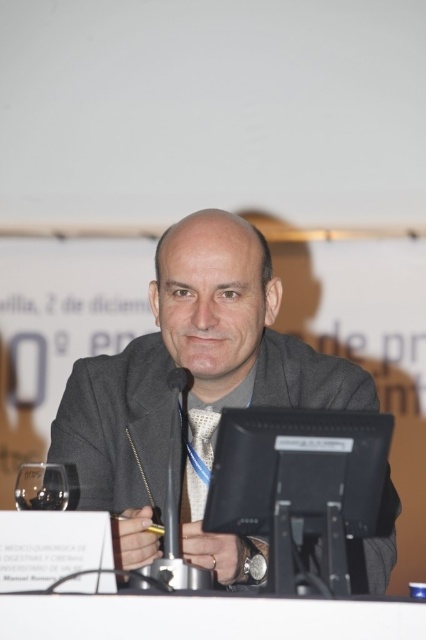
Who is positioned more to the right, gray woolen suit at center or black plastic table at lower center?

From the viewer's perspective, black plastic table at lower center appears more on the right side.

Is gray woolen suit at center to the left of black plastic table at lower center from the viewer's perspective?

Correct, you'll find gray woolen suit at center to the left of black plastic table at lower center.

Locate an element on the screen. Image resolution: width=426 pixels, height=640 pixels. gray woolen suit at center is located at coordinates (189, 371).

Identify the location of gray woolen suit at center. (189, 371).

Does gray woolen suit at center appear on the left side of silver textured tie at center?

In fact, gray woolen suit at center is to the right of silver textured tie at center.

Is point (178, 314) more distant than point (206, 429)?

No, (178, 314) is in front of (206, 429).

Identify the location of gray woolen suit at center. Image resolution: width=426 pixels, height=640 pixels. (189, 371).

Who is positioned more to the left, black plastic table at lower center or silver textured tie at center?

silver textured tie at center is more to the left.

Can you confirm if black plastic table at lower center is shorter than silver textured tie at center?

Yes, black plastic table at lower center is shorter than silver textured tie at center.

You are a GUI agent. You are given a task and a screenshot of the screen. Output one action in this format:
    pyautogui.click(x=<x>, y=<y>)
    Task: Click on the black plastic table at lower center
    
    Given the screenshot: What is the action you would take?
    pyautogui.click(x=206, y=618)

Locate an element on the screen. The image size is (426, 640). black plastic table at lower center is located at coordinates (206, 618).